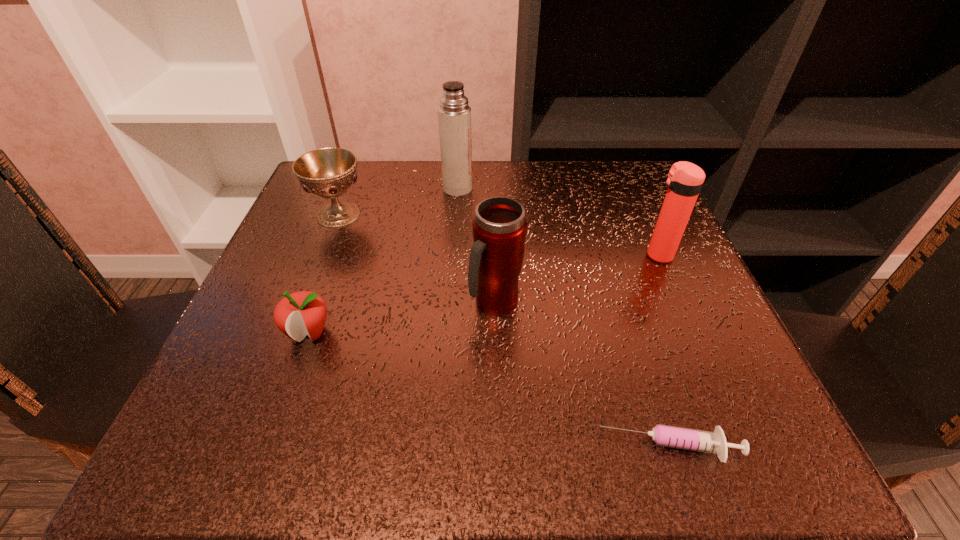
Locate an element on the screen. The image size is (960, 540). apple that is positioned at the left edge is located at coordinates (298, 314).

Locate an element on the screen. This screenshot has height=540, width=960. thermos bottle that is at the right edge is located at coordinates (684, 182).

Find the location of `syringe that is positioned at the right edge`. syringe that is positioned at the right edge is located at coordinates (714, 442).

Locate an element on the screen. object at the far left corner is located at coordinates (327, 172).

Locate an element on the screen. This screenshot has height=540, width=960. object situated at the near right corner is located at coordinates (714, 442).

The width and height of the screenshot is (960, 540). In the image, there is a desktop. Identify the location of vacant area at the far edge. coord(391,182).

Locate an element on the screen. vacant space at the near edge of the desktop is located at coordinates (348, 415).

Locate an element on the screen. free space at the left edge is located at coordinates (297, 226).

The image size is (960, 540). I want to click on vacant space at the right edge of the desktop, so tap(661, 374).

Find the location of a particular element. The width and height of the screenshot is (960, 540). vacant space at the near left corner of the desktop is located at coordinates (216, 436).